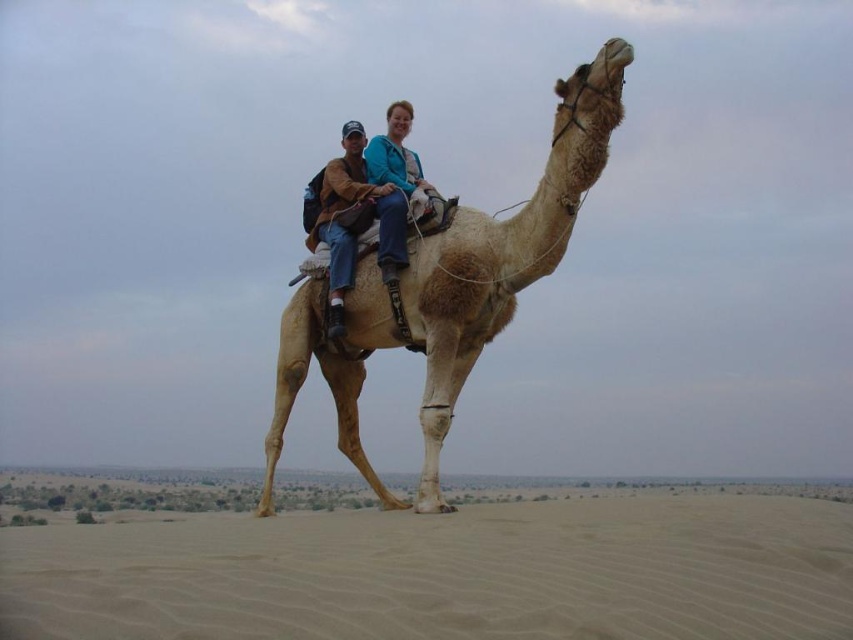
Question: Does matte brown leather saddle at center have a larger size compared to blue textured jacket at center?

Choices:
 (A) no
 (B) yes

Answer: (B)

Question: Which of the following is the farthest from the observer?

Choices:
 (A) blue textured jacket at center
 (B) light beige textured camel at center

Answer: (A)

Question: Does matte brown leather saddle at center have a larger size compared to blue textured jacket at center?

Choices:
 (A) yes
 (B) no

Answer: (A)

Question: Which of the following is the farthest from the observer?

Choices:
 (A) fine-grained sand at lower center
 (B) light beige textured camel at center
 (C) blue textured jacket at center

Answer: (C)

Question: Is fine-grained sand at lower center to the left of blue textured jacket at center from the viewer's perspective?

Choices:
 (A) yes
 (B) no

Answer: (A)

Question: Which of the following is the farthest from the observer?

Choices:
 (A) fine-grained sand at lower center
 (B) light beige textured camel at center
 (C) blue textured jacket at center

Answer: (C)